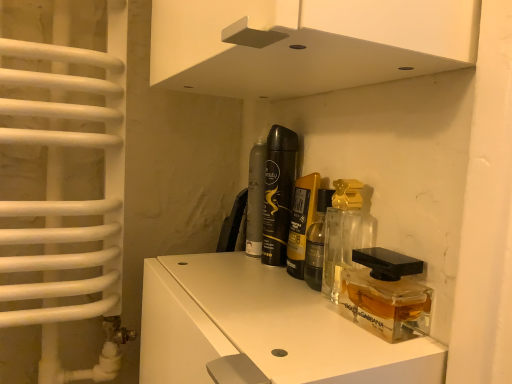
Where is `vacant space in front of translucent glass perfume at center, the 2th perfume when ordered from back to front`? This screenshot has height=384, width=512. vacant space in front of translucent glass perfume at center, the 2th perfume when ordered from back to front is located at coordinates (266, 300).